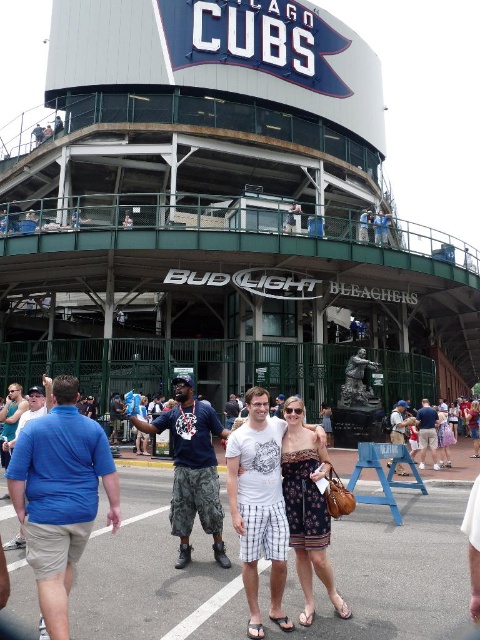
You are a photographer trying to capture both the patterned fabric dress at center and the matte brown statue at center in the same frame. Which object should you focus on first if you want to ensure both are in focus without adjusting your camera settings?

The matte brown statue at center is thicker than the patterned fabric dress at center, so focusing on the matte brown statue at center first would help ensure both are in focus since it has a larger depth of field requirement.

You are standing at the entrance of Wrigley Field and see two points marked on the stadium wall. Which point is closer to you, point (312,432) or point (415,419)?

Point (312,432) is closer to the viewer than point (415,419).

You are a photographer at the event and want to capture both the patterned fabric dress at center and the matte brown statue at center in a single frame. Which object should you position closer to the left side of your camera viewfinder to ensure both are included?

To include both the patterned fabric dress at center and the matte brown statue at center in your frame, position the patterned fabric dress at center closer to the left side of your camera viewfinder since it is already to the left of the matte brown statue at center.